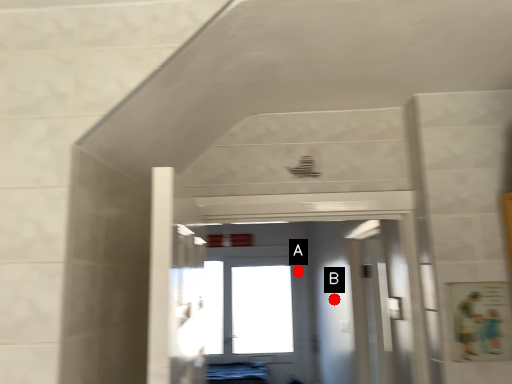
Question: Two points are circled on the image, labeled by A and B beside each circle. Which point is farther to the camera?

Choices:
 (A) A is further
 (B) B is further

Answer: (A)